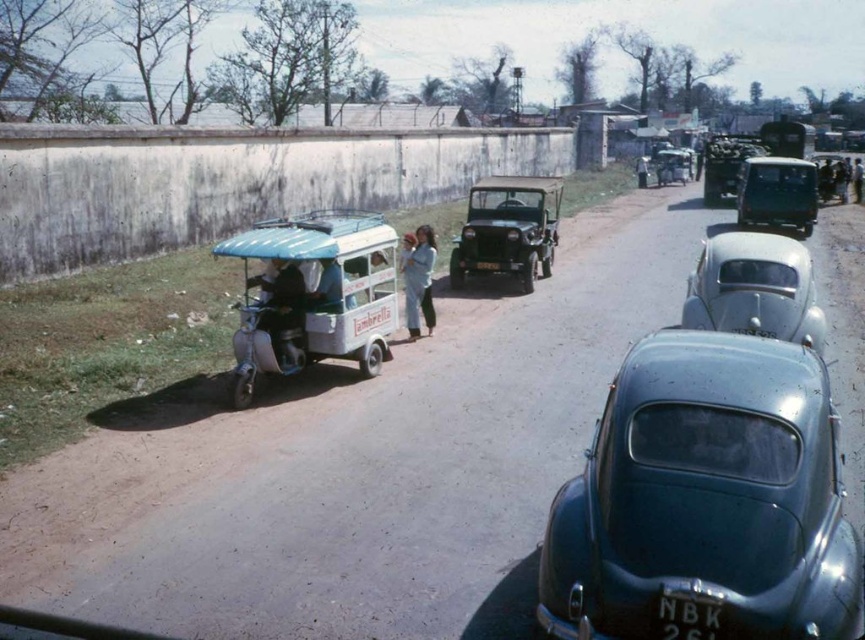
Question: Does light blue plastic rickshaw at left have a smaller size compared to dark blue fabric jacket at center?

Choices:
 (A) yes
 (B) no

Answer: (A)

Question: Which point appears closest to the camera in this image?

Choices:
 (A) (673, 637)
 (B) (476, 262)

Answer: (A)

Question: Is metallic blue car at center closer to the viewer compared to black plastic license plate at lower center?

Choices:
 (A) yes
 (B) no

Answer: (A)

Question: Does silver metallic car at center appear on the left side of blue fabric umbrella at left?

Choices:
 (A) yes
 (B) no

Answer: (B)

Question: Which point is farther to the camera?

Choices:
 (A) (x=703, y=531)
 (B) (x=663, y=618)

Answer: (A)

Question: Which point is farther to the camera?

Choices:
 (A) black plastic license plate at center
 (B) light blue fabric pants at center
 (C) black plastic license plate at lower center
 (D) dark blue fabric jacket at center

Answer: (D)